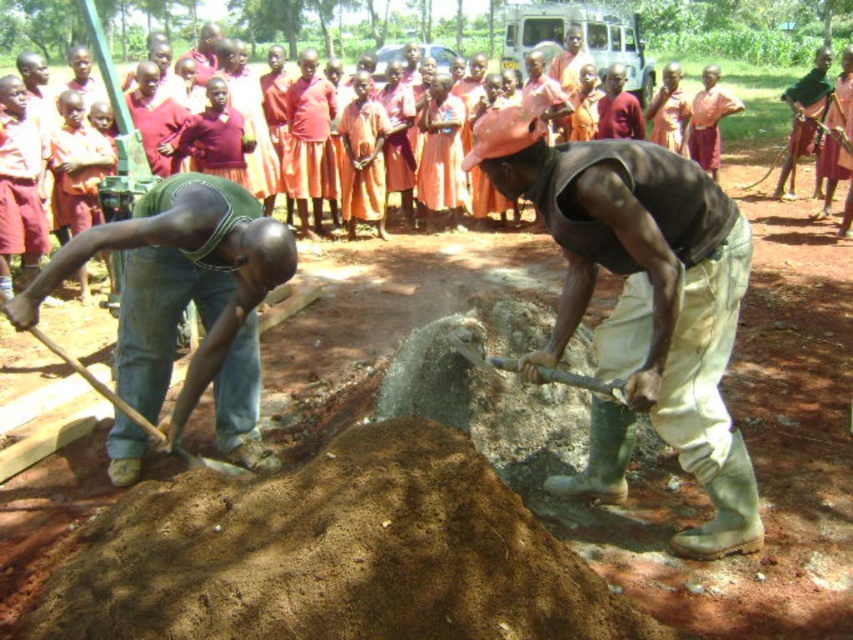
You are a construction worker who needs to retrieve a shovel from the ground. Which shovel, the wooden handle shovel at lower left or the wooden shovel at center, is easier to reach without moving your current position?

The wooden handle shovel at lower left is located below the wooden shovel at center, so it is closer to the ground and easier to reach without moving your position.

You are standing at the camera position and want to pick up the wooden handle shovel at lower left. Is it within your immediate reach without moving your feet?

The wooden handle shovel at lower left is 9.59 feet away from the camera, so it is out of immediate reach without moving your feet.

You are a construction supervisor checking the site. You notice the brown dirt mound at center and the matte green vest at center. Which object is taller?

The matte green vest at center is taller than the brown dirt mound at center.